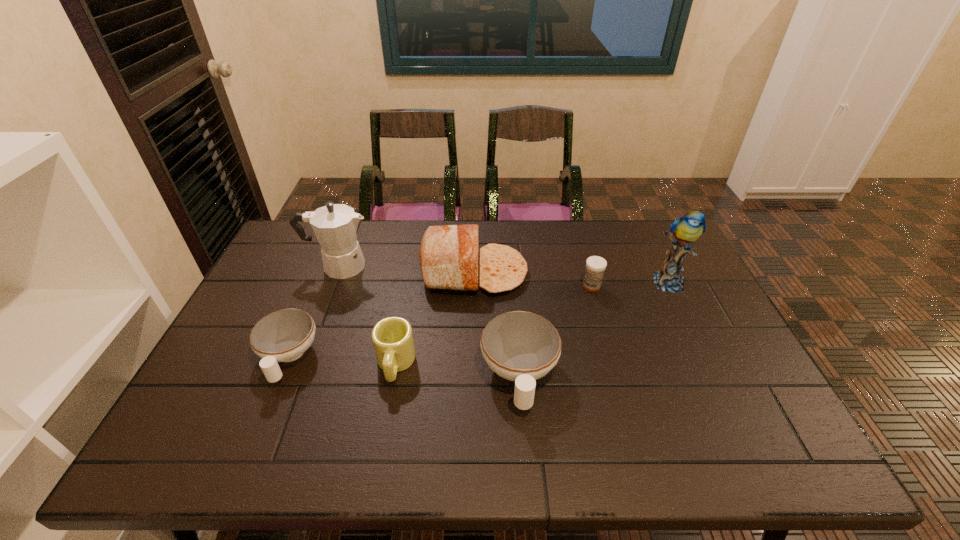
This screenshot has width=960, height=540. I want to click on the shorter chinaware, so click(282, 336).

The width and height of the screenshot is (960, 540). Find the location of `the right chinaware`. the right chinaware is located at coordinates (520, 346).

This screenshot has height=540, width=960. What are the coordinates of `coffeepot` in the screenshot? It's located at (335, 225).

Where is `the third tallest object`? Image resolution: width=960 pixels, height=540 pixels. the third tallest object is located at coordinates (448, 256).

Where is `medicine`? The width and height of the screenshot is (960, 540). medicine is located at coordinates (595, 266).

The image size is (960, 540). In order to click on the tallest object in this screenshot , I will do `click(684, 230)`.

You are a GUI agent. You are given a task and a screenshot of the screen. Output one action in this format:
    pyautogui.click(x=<x>, y=<y>)
    Task: Click on the rightmost object
    
    Given the screenshot: What is the action you would take?
    pyautogui.click(x=684, y=230)

This screenshot has width=960, height=540. I want to click on mug, so click(392, 337).

Where is `vacant space located on the side with the handle of the left chinaware`? The image size is (960, 540). vacant space located on the side with the handle of the left chinaware is located at coordinates (263, 418).

Find the location of a particular element. The height and width of the screenshot is (540, 960). free space located 0.280m at the spout of the second tallest object is located at coordinates (459, 266).